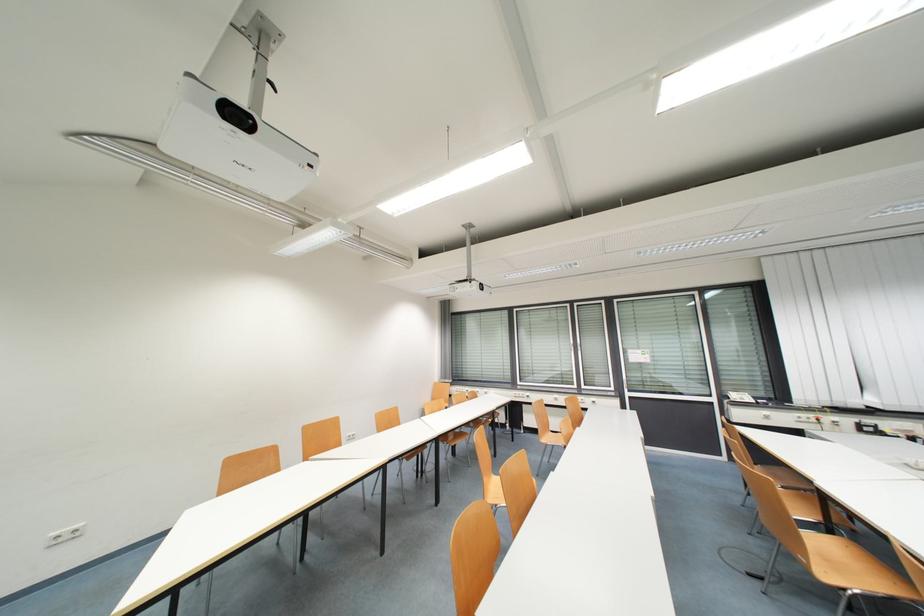
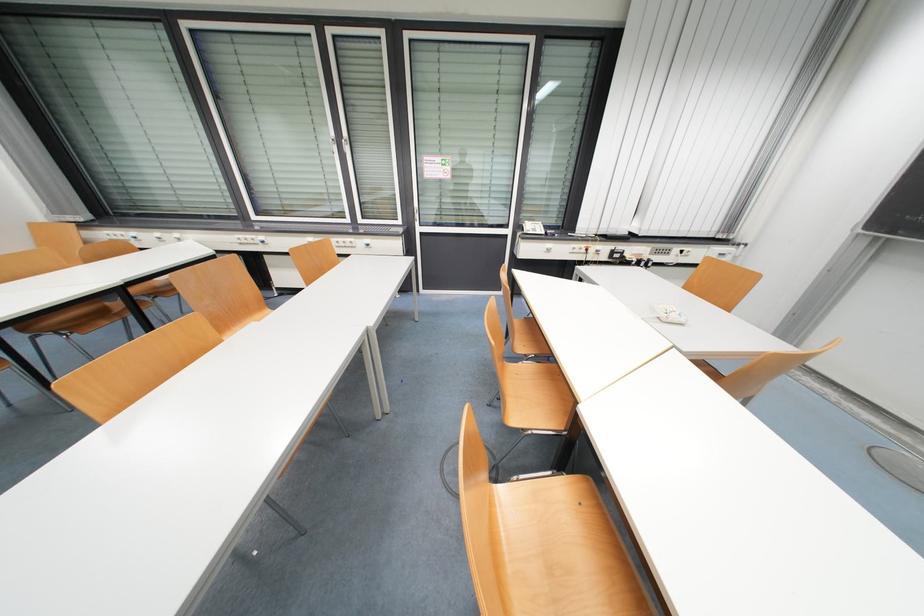
The point at (728, 398) is marked in the first image. Where is the corresponding point in the second image?

(524, 229)